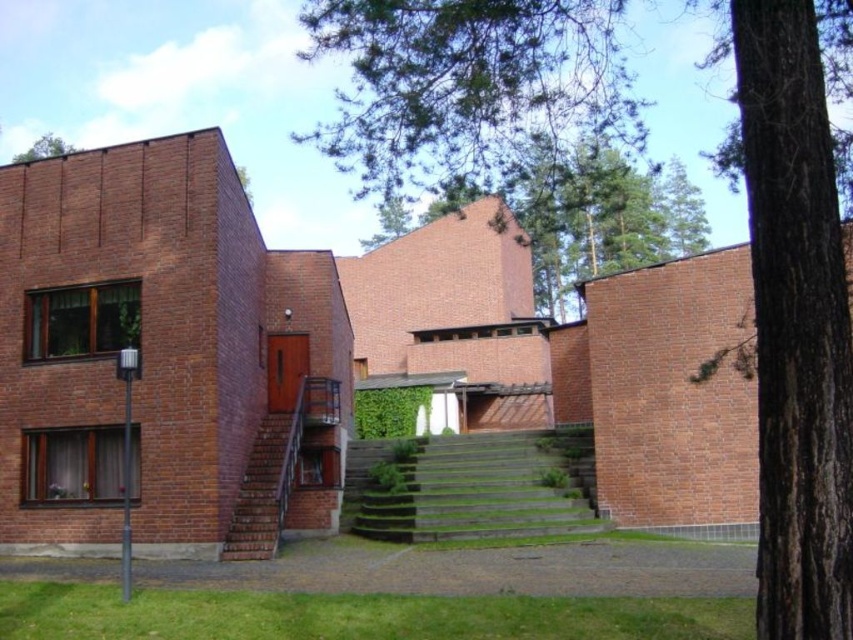
Question: Does green leafy tree at center have a larger size compared to green concrete stairs at center?

Choices:
 (A) no
 (B) yes

Answer: (B)

Question: Which of the following is the farthest from the observer?

Choices:
 (A) (260, 547)
 (B) (56, 152)
 (C) (525, 476)

Answer: (B)

Question: Is green leafy tree at upper center closer to the viewer compared to green leafy tree at upper left?

Choices:
 (A) no
 (B) yes

Answer: (B)

Question: Which point is closer to the camera?

Choices:
 (A) green leafy tree at upper left
 (B) brick stairs at lower left
 (C) green concrete stairs at center

Answer: (B)

Question: Is green leafy tree at center positioned before green concrete stairs at center?

Choices:
 (A) no
 (B) yes

Answer: (B)

Question: Which object is positioned closest to the green leafy tree at upper center?

Choices:
 (A) green concrete stairs at center
 (B) brick stairs at lower left
 (C) green leafy tree at upper left
 (D) green leafy tree at center

Answer: (D)